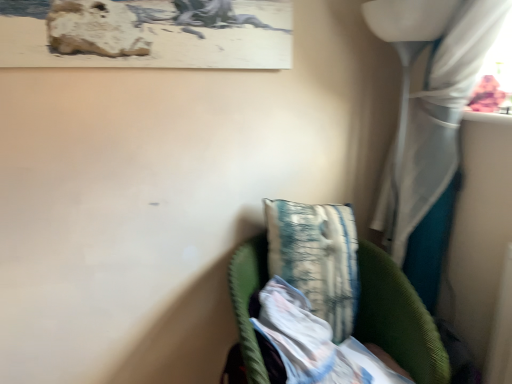
Question: Do you think white textured fabric at lower center is within green corduroy chair at lower right, or outside of it?

Choices:
 (A) inside
 (B) outside

Answer: (A)

Question: Is point (264, 336) positioned closer to the camera than point (396, 296)?

Choices:
 (A) farther
 (B) closer

Answer: (B)

Question: Considering the real-world distances, which object is closest to the textured fabric pillow at center?

Choices:
 (A) white textured fabric at lower center
 (B) white sheer curtain at right
 (C) green corduroy chair at lower right

Answer: (C)

Question: Estimate the real-world distances between objects in this image. Which object is closer to the white sheer curtain at right?

Choices:
 (A) textured fabric pillow at center
 (B) white textured fabric at lower center
 (C) green corduroy chair at lower right

Answer: (A)